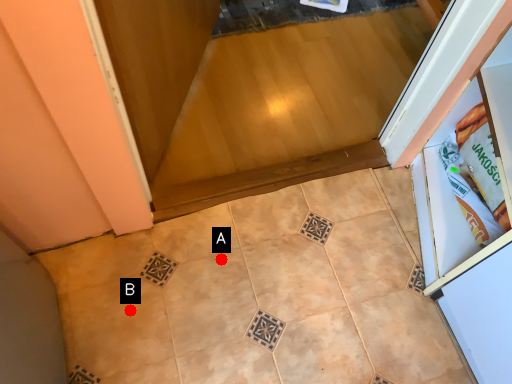
Question: Two points are circled on the image, labeled by A and B beside each circle. Among these points, which one is farthest from the camera?

Choices:
 (A) A is further
 (B) B is further

Answer: (A)